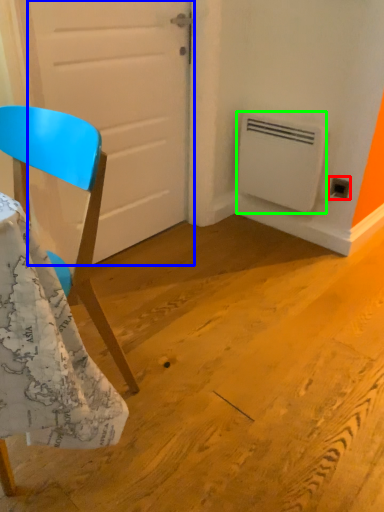
Question: Which is farther away from electric outlet (highlighted by a red box)? door (highlighted by a blue box) or air conditioning (highlighted by a green box)?

Choices:
 (A) door
 (B) air conditioning

Answer: (A)